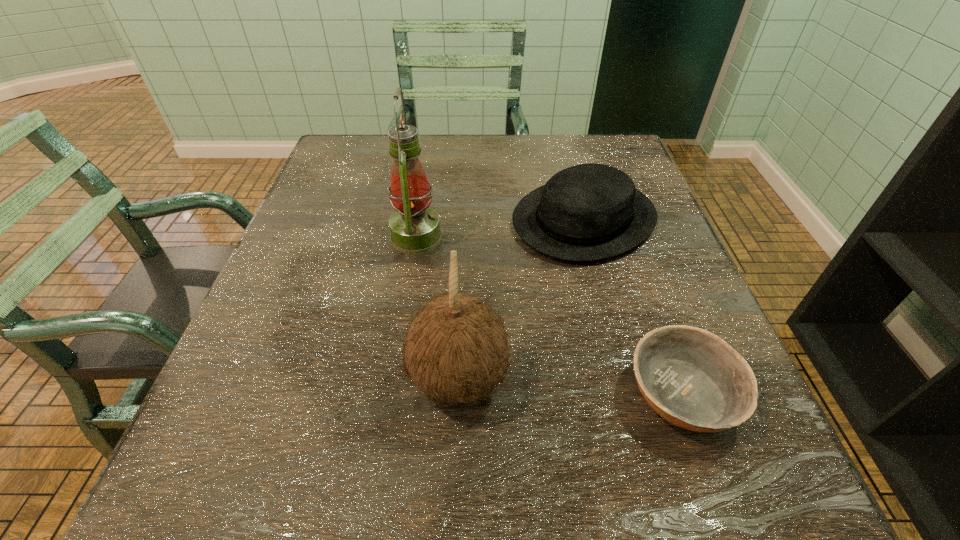
I want to click on the tallest object, so [414, 227].

I want to click on coconut, so click(456, 351).

You are a GUI agent. You are given a task and a screenshot of the screen. Output one action in this format:
    pyautogui.click(x=<x>, y=<y>)
    Task: Click on the second shortest object
    The image size is (960, 540).
    Given the screenshot: What is the action you would take?
    pyautogui.click(x=588, y=212)

The image size is (960, 540). What are the coordinates of `bowl` in the screenshot? It's located at 692,378.

This screenshot has height=540, width=960. I want to click on vacant space located on the left of the tallest object, so click(x=315, y=237).

This screenshot has width=960, height=540. In order to click on vacant area situated on the surface of the coconut in this screenshot , I will do `click(542, 380)`.

I want to click on free space located on the front of the second shortest object, so click(628, 381).

You are a GUI agent. You are given a task and a screenshot of the screen. Output one action in this format:
    pyautogui.click(x=<x>, y=<y>)
    Task: Click on the vacant position located on the left of the shortest object
    The image size is (960, 540).
    Given the screenshot: What is the action you would take?
    click(x=376, y=393)

At what (x,y) coordinates should I click in order to perform the action: click on fedora located at the right edge. Please return your answer as a coordinate pair (x, y). Looking at the image, I should click on (588, 212).

Where is `bowl that is at the right edge`? This screenshot has height=540, width=960. bowl that is at the right edge is located at coordinates (692, 378).